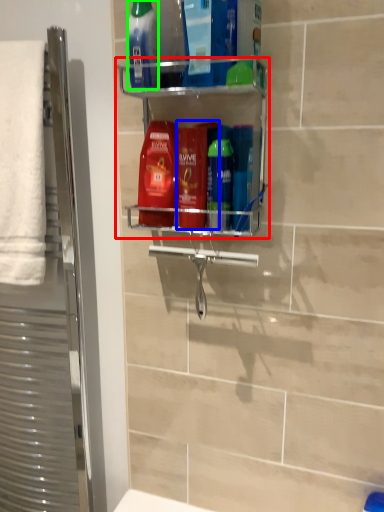
Question: Which is nearer to the shelf (highlighted by a red box)? mouthwash (highlighted by a blue box) or mouthwash (highlighted by a green box).

Choices:
 (A) mouthwash
 (B) mouthwash

Answer: (A)